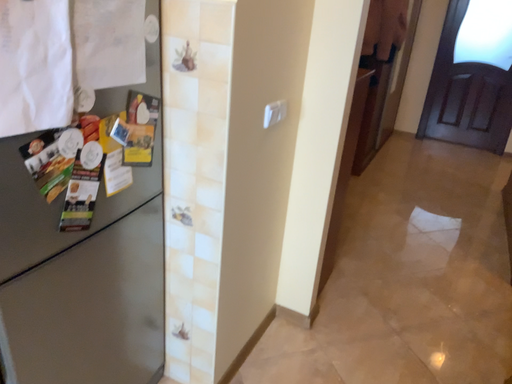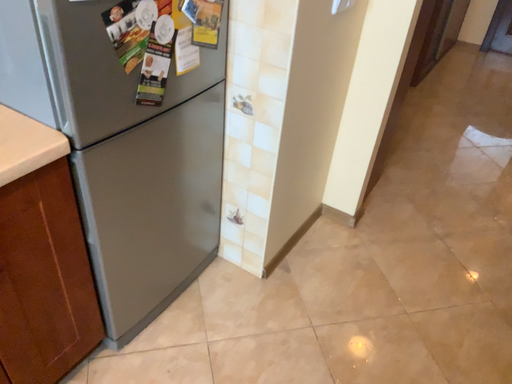
Question: How did the camera likely rotate when shooting the video?

Choices:
 (A) rotated upward
 (B) rotated downward

Answer: (B)